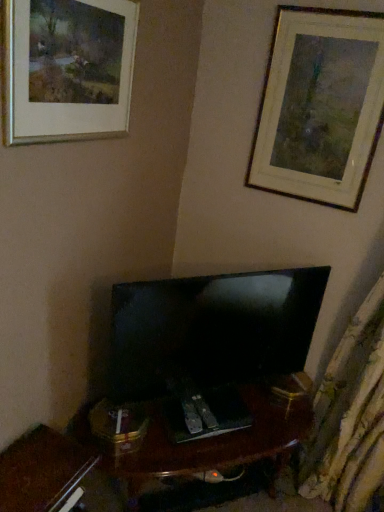
Question: Is wooden picture frame at upper right, positioned as the 1th picture frame in back-to-front order, not near matte black tv at center?

Choices:
 (A) no
 (B) yes

Answer: (A)

Question: Is wooden picture frame at upper right, positioned as the 1th picture frame in back-to-front order, behind matte black tv at center?

Choices:
 (A) no
 (B) yes

Answer: (B)

Question: Is wooden picture frame at upper right, which is the second picture frame from front to back, wider than matte black tv at center?

Choices:
 (A) yes
 (B) no

Answer: (B)

Question: Does wooden picture frame at upper right, positioned as the 1th picture frame in back-to-front order, have a greater height compared to matte black tv at center?

Choices:
 (A) yes
 (B) no

Answer: (A)

Question: Is wooden picture frame at upper right, positioned as the 1th picture frame in back-to-front order, beside matte black tv at center?

Choices:
 (A) yes
 (B) no

Answer: (B)

Question: Considering the relative positions of wooden picture frame at upper right, positioned as the 2th picture frame in left-to-right order, and matte black tv at center in the image provided, is wooden picture frame at upper right, positioned as the 2th picture frame in left-to-right order, to the left of matte black tv at center from the viewer's perspective?

Choices:
 (A) no
 (B) yes

Answer: (A)

Question: Is silver metallic picture frame at upper left, marked as the first picture frame in a left-to-right arrangement, looking in the opposite direction of matte black tv at center?

Choices:
 (A) yes
 (B) no

Answer: (B)

Question: Does silver metallic picture frame at upper left, marked as the first picture frame in a left-to-right arrangement, turn towards matte black tv at center?

Choices:
 (A) no
 (B) yes

Answer: (A)

Question: From the image's perspective, would you say silver metallic picture frame at upper left, which appears as the 2th picture frame when viewed from the right, is positioned over matte black tv at center?

Choices:
 (A) no
 (B) yes

Answer: (B)

Question: Is silver metallic picture frame at upper left, which appears as the 2th picture frame when viewed from the right, beside matte black tv at center?

Choices:
 (A) yes
 (B) no

Answer: (B)

Question: From a real-world perspective, is silver metallic picture frame at upper left, the 2th picture frame from the back, over matte black tv at center?

Choices:
 (A) no
 (B) yes

Answer: (B)

Question: Can you confirm if silver metallic picture frame at upper left, marked as the first picture frame in a left-to-right arrangement, is positioned to the right of matte black tv at center?

Choices:
 (A) no
 (B) yes

Answer: (A)

Question: From a real-world perspective, is matte black tv at center physically above silver metallic picture frame at upper left, which appears as the 2th picture frame when viewed from the right?

Choices:
 (A) yes
 (B) no

Answer: (B)